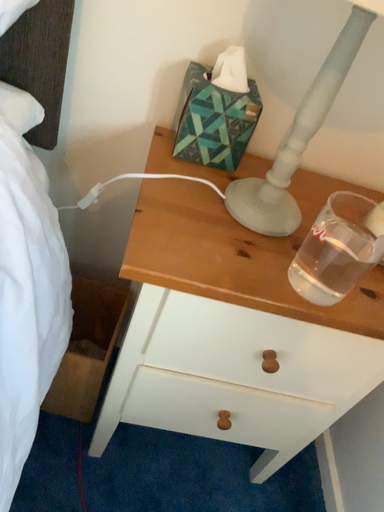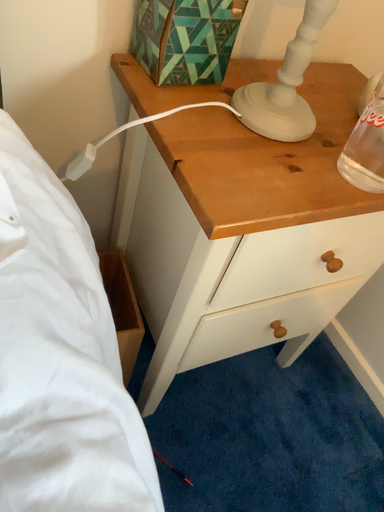
Question: How did the camera likely rotate when shooting the video?

Choices:
 (A) rotated left
 (B) rotated right

Answer: (B)